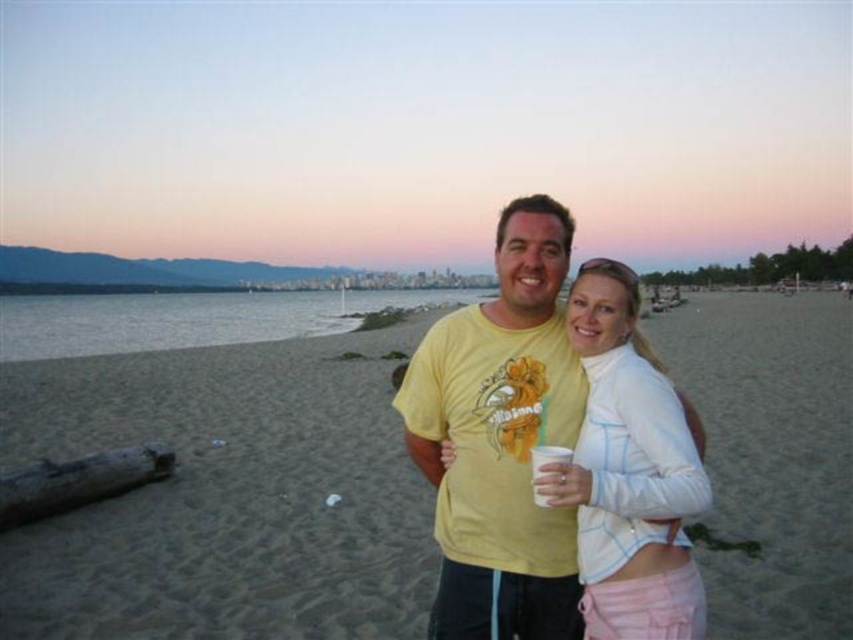
Question: Where is sandy beach at center located in relation to white matte jacket at center in the image?

Choices:
 (A) below
 (B) above

Answer: (A)

Question: Does yellow cotton t-shirt at center appear on the left side of white matte jacket at center?

Choices:
 (A) no
 (B) yes

Answer: (B)

Question: Considering the real-world distances, which object is farthest from the white matte jacket at center?

Choices:
 (A) sandy beach at center
 (B) white paper cup at center
 (C) yellow cotton t-shirt at center

Answer: (A)

Question: Which point is farther from the camera taking this photo?

Choices:
 (A) (639, 572)
 (B) (170, 417)

Answer: (B)

Question: Which of these objects is positioned farthest from the white paper cup at center?

Choices:
 (A) white matte jacket at center
 (B) yellow cotton t-shirt at center

Answer: (B)

Question: Is yellow cotton t-shirt at center further to the viewer compared to white matte jacket at center?

Choices:
 (A) no
 (B) yes

Answer: (B)